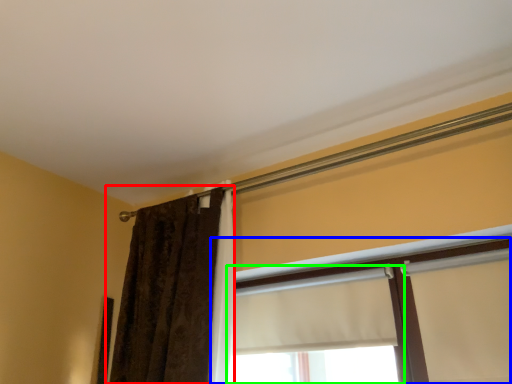
Question: Based on their relative distances, which object is farther from curtain (highlighted by a red box)? Choose from window (highlighted by a blue box) and window (highlighted by a green box).

Choices:
 (A) window
 (B) window

Answer: (A)